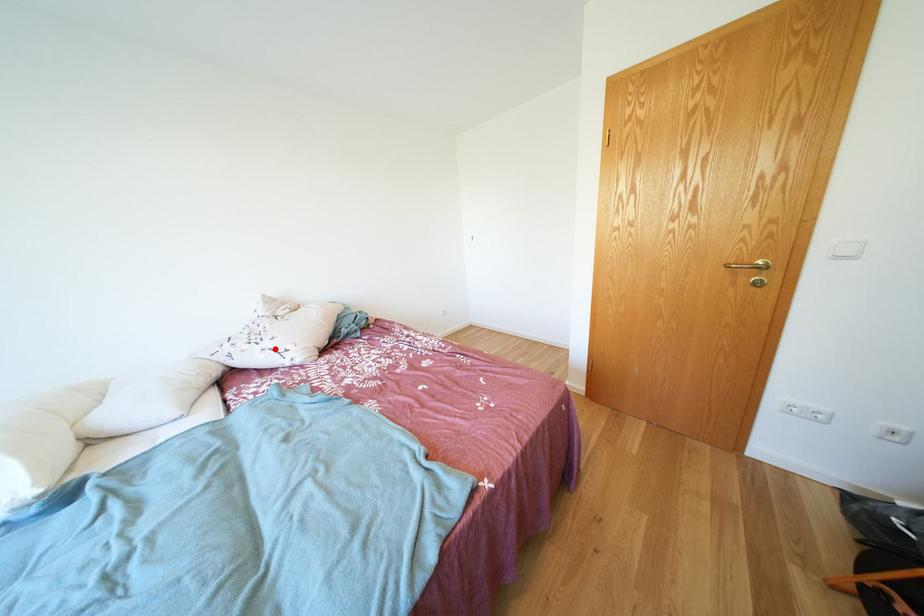
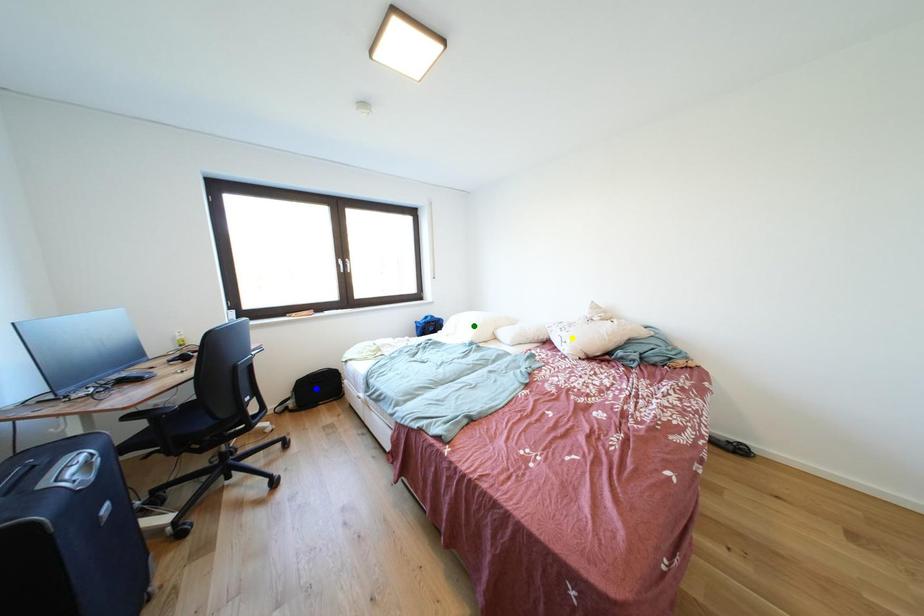
Question: I am providing you with two images of the same scene from different viewpoints. A red point is marked on the first image. You are given multiple points on the second image. Can you choose the point in image 2 that corresponds to the point in image 1?

Choices:
 (A) yellow point
 (B) blue point
 (C) green point

Answer: (A)